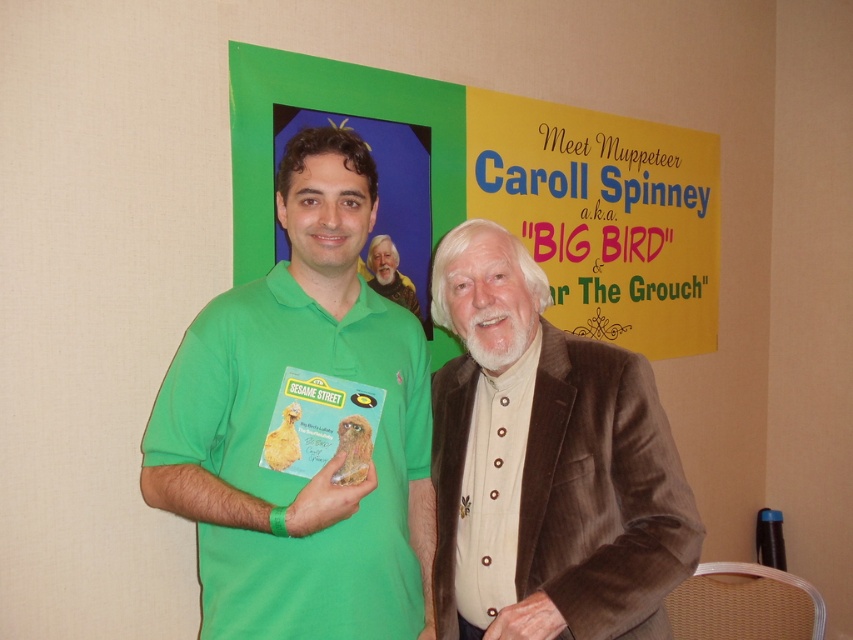
You are an interior designer assessing the wall space in this room. The green matte poster at upper center and the beige textured suit at center are both on the wall. Which object takes up more space on the wall?

The green matte poster at upper center takes up more space on the wall since it has a larger size compared to the beige textured suit at center.

From the picture: You are a photographer holding a camera. You want to take a photo of the green matte poster at upper center. The camera is currently 1.76 meters away from the poster. Is this distance suitable for capturing the entire poster in the frame?

The distance between the camera and the green matte poster at upper center is exactly 1.76 meters. This distance is suitable for capturing the entire poster in the frame as long as the camera is positioned correctly and the lens is appropriate for the task.

You are a photographer setting up for a group photo. You need to ensure that the green cotton shirt at center and the green matte poster at upper center are at least 36 inches apart to avoid overlapping in the frame. Based on the current positions, is this requirement met?

The green cotton shirt at center and the green matte poster at upper center are currently 30.27 inches apart, which is less than the required 36 inches. Therefore, the requirement is not met, and adjustments are needed to increase the distance between them.